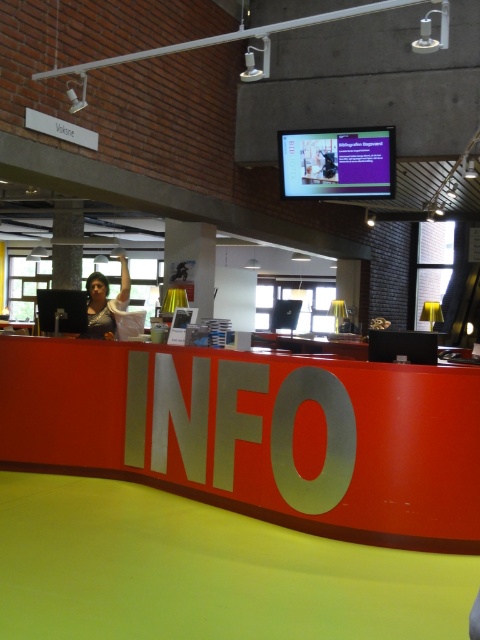
Between red matte info sign at center and white fabric shirt at left, which one appears on the left side from the viewer's perspective?

From the viewer's perspective, white fabric shirt at left appears more on the left side.

Who is more distant from viewer, (21, 419) or (113, 307)?

The point (113, 307) is behind.

The width and height of the screenshot is (480, 640). What do you see at coordinates (256, 433) in the screenshot?
I see `red matte info sign at center` at bounding box center [256, 433].

This screenshot has width=480, height=640. I want to click on red matte info sign at center, so click(x=256, y=433).

Who is positioned more to the right, red matte info sign at center or matte gray pillar at center?

red matte info sign at center is more to the right.

Image resolution: width=480 pixels, height=640 pixels. I want to click on red matte info sign at center, so click(x=256, y=433).

Does point (160, 456) come farther from viewer compared to point (70, 285)?

No, it is in front of (70, 285).

Image resolution: width=480 pixels, height=640 pixels. Identify the location of red matte info sign at center. (256, 433).

Which is below, matte gray pillar at center or white fabric shirt at left?

Positioned lower is white fabric shirt at left.

Where is `matte gray pillar at center`? The height and width of the screenshot is (640, 480). matte gray pillar at center is located at coordinates click(x=66, y=266).

Find the location of a particular element. matte gray pillar at center is located at coordinates (66, 266).